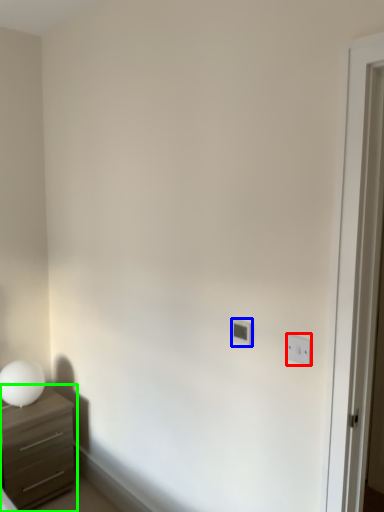
Question: Which object is the closest to the light switch (highlighted by a red box)? Choose among these: light switch (highlighted by a blue box) or chest of drawers (highlighted by a green box).

Choices:
 (A) light switch
 (B) chest of drawers

Answer: (A)